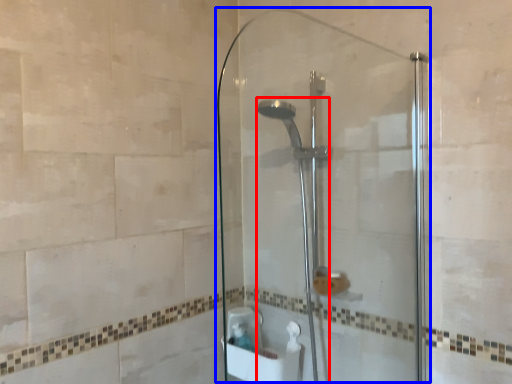
Question: Which of the following is the farthest to the observer, shower (highlighted by a red box) or screen door (highlighted by a blue box)?

Choices:
 (A) shower
 (B) screen door

Answer: (A)